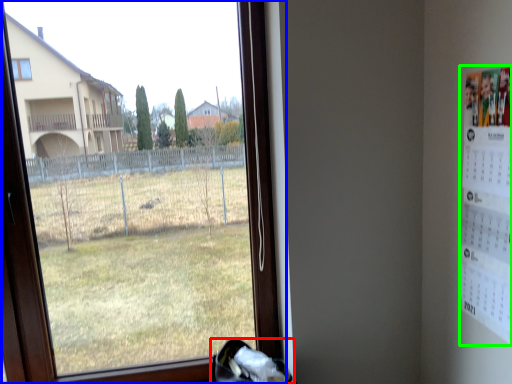
Question: Which object is positioned closest to shoe (highlighted by a red box)? Select from window (highlighted by a blue box) and poster (highlighted by a green box).

Choices:
 (A) window
 (B) poster

Answer: (B)